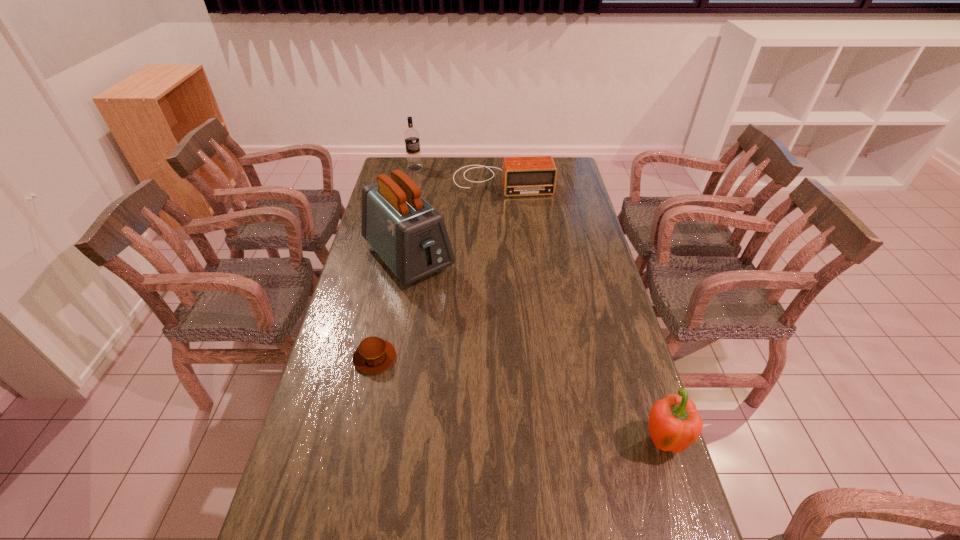
Identify the location of vacant point located between the pepper and the second tallest object. This screenshot has height=540, width=960. (539, 305).

The height and width of the screenshot is (540, 960). What are the coordinates of `free space that is in between the radio receiver and the toaster` in the screenshot? It's located at (455, 220).

At what (x,y) coordinates should I click in order to perform the action: click on empty space that is in between the third tallest object and the second shortest object. Please return your answer as a coordinate pair (x, y). Looking at the image, I should click on pyautogui.click(x=582, y=312).

Choose which object is the third nearest neighbor to the pepper. Please provide its 2D coordinates. Your answer should be formatted as a tuple, i.e. [(x, y)], where the tuple contains the x and y coordinates of a point satisfying the conditions above.

[(521, 176)]

Find the location of a particular element. The width and height of the screenshot is (960, 540). object that is the third nearest to the fourth shortest object is located at coordinates (374, 355).

Where is `free space that satisfies the following two spatial constraints: 1. on the front side of the vodka; 2. on the right side of the fourth tallest object`? The width and height of the screenshot is (960, 540). free space that satisfies the following two spatial constraints: 1. on the front side of the vodka; 2. on the right side of the fourth tallest object is located at coordinates (412, 181).